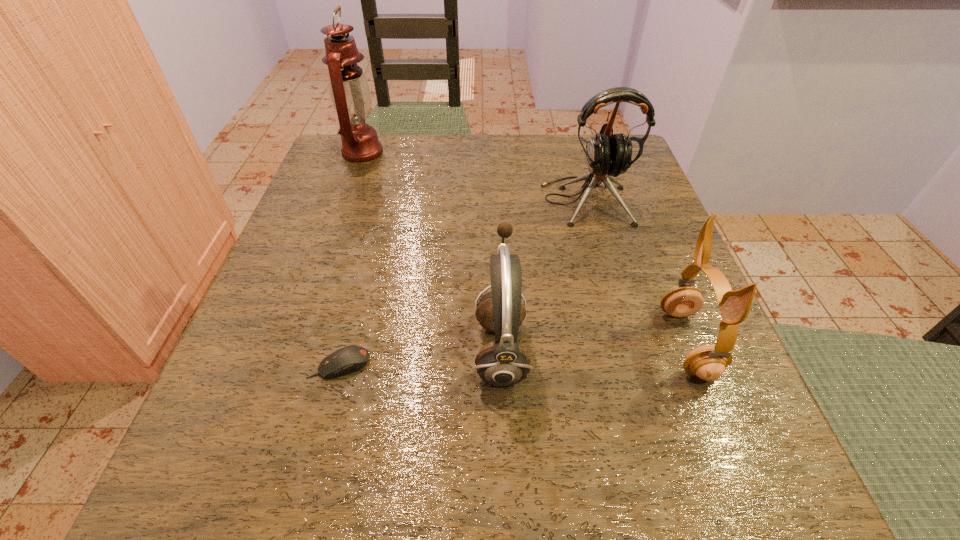
Identify the location of the tallest object. This screenshot has width=960, height=540. (350, 94).

Find the location of a particular element. This screenshot has width=960, height=540. the farthest object is located at coordinates (350, 94).

You are a GUI agent. You are given a task and a screenshot of the screen. Output one action in this format:
    pyautogui.click(x=<x>, y=<y>)
    Task: Click on the second farthest object
    Image resolution: width=960 pixels, height=540 pixels.
    Given the screenshot: What is the action you would take?
    pyautogui.click(x=608, y=154)

Identify the location of the fourth shortest object. (608, 154).

I want to click on the leftmost earphone, so click(504, 362).

I want to click on computer mouse, so click(348, 359).

This screenshot has height=540, width=960. In order to click on free space located 0.240m on the front of the tallest object in this screenshot , I will do `click(332, 239)`.

Identify the location of free space located on the back of the farthest earphone. This screenshot has height=540, width=960. (575, 163).

Where is `vacant point located on the ear pads of the third object from right to left`? The image size is (960, 540). vacant point located on the ear pads of the third object from right to left is located at coordinates (245, 349).

Locate an element on the screen. The width and height of the screenshot is (960, 540). free space located 0.100m on the ear pads of the third object from right to left is located at coordinates (407, 349).